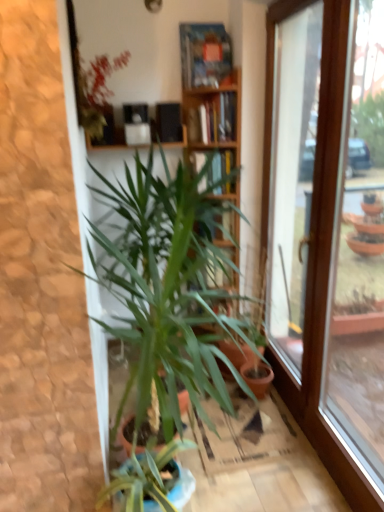
Question: Could green leafy plant at upper left, placed as the 1th houseplant when sorted from top to bottom, be considered to be inside green leafy plant at center, arranged as the 2th houseplant when viewed from the top?

Choices:
 (A) no
 (B) yes

Answer: (A)

Question: Can you confirm if green leafy plant at center, arranged as the 2th houseplant when viewed from the top, is thinner than green leafy plant at upper left, placed as the 1th houseplant when sorted from top to bottom?

Choices:
 (A) yes
 (B) no

Answer: (B)

Question: From a real-world perspective, is green leafy plant at center, which is the 1th houseplant in bottom-to-top order, physically below green leafy plant at upper left, placed as the 1th houseplant when sorted from top to bottom?

Choices:
 (A) yes
 (B) no

Answer: (A)

Question: Can you confirm if green leafy plant at center, which is the 1th houseplant in bottom-to-top order, is smaller than green leafy plant at upper left, placed as the 1th houseplant when sorted from top to bottom?

Choices:
 (A) yes
 (B) no

Answer: (B)

Question: Is green leafy plant at center, arranged as the 2th houseplant when viewed from the top, facing away from green leafy plant at upper left, placed as the 1th houseplant when sorted from top to bottom?

Choices:
 (A) no
 (B) yes

Answer: (A)

Question: In the image, is green leafy plant at upper left, which is the 2th houseplant from bottom to top, positioned in front of or behind green leafy plant at center, which is the 1th houseplant in bottom-to-top order?

Choices:
 (A) behind
 (B) front

Answer: (B)

Question: In terms of height, does green leafy plant at upper left, placed as the 1th houseplant when sorted from top to bottom, look taller or shorter compared to green leafy plant at center, arranged as the 2th houseplant when viewed from the top?

Choices:
 (A) short
 (B) tall

Answer: (A)

Question: Is green leafy plant at upper left, which is the 2th houseplant from bottom to top, bigger or smaller than green leafy plant at center, which is the 1th houseplant in bottom-to-top order?

Choices:
 (A) small
 (B) big

Answer: (A)

Question: From a real-world perspective, is green leafy plant at upper left, which is the 2th houseplant from bottom to top, physically located above or below green leafy plant at center, arranged as the 2th houseplant when viewed from the top?

Choices:
 (A) above
 (B) below

Answer: (A)

Question: In terms of width, does green leafy plant at upper left, which is the 2th houseplant from bottom to top, look wider or thinner when compared to wooden bookcase at center?

Choices:
 (A) thin
 (B) wide

Answer: (A)

Question: From a real-world perspective, relative to wooden bookcase at center, is green leafy plant at upper left, which is the 2th houseplant from bottom to top, vertically above or below?

Choices:
 (A) below
 (B) above

Answer: (B)

Question: Is green leafy plant at upper left, which is the 2th houseplant from bottom to top, taller or shorter than wooden bookcase at center?

Choices:
 (A) tall
 (B) short

Answer: (B)

Question: Based on their sizes in the image, would you say green leafy plant at upper left, which is the 2th houseplant from bottom to top, is bigger or smaller than wooden bookcase at center?

Choices:
 (A) small
 (B) big

Answer: (A)

Question: Does point (296, 129) appear closer or farther from the camera than point (200, 54)?

Choices:
 (A) farther
 (B) closer

Answer: (A)

Question: Do you think transparent glass window at right is within wooden bookcase at center, or outside of it?

Choices:
 (A) outside
 (B) inside

Answer: (A)